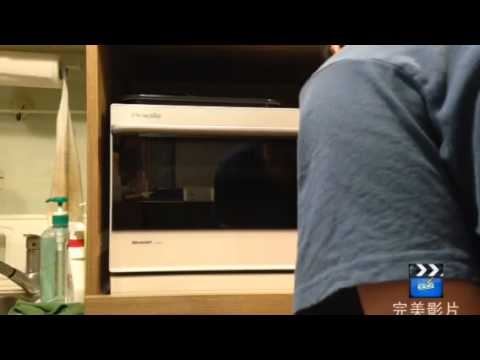
This screenshot has width=480, height=360. Find the location of `paper towels`. paper towels is located at coordinates (10, 67).